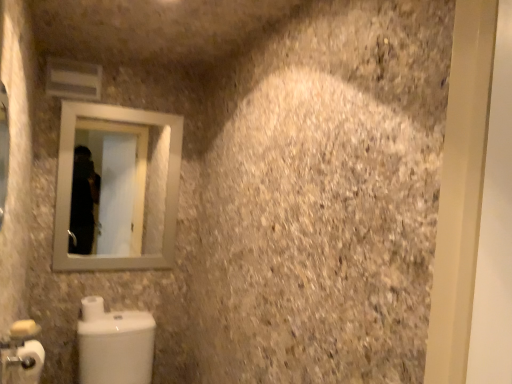
Question: Is white matte toilet paper at lower left, arranged as the second toilet paper when viewed from the front, in front of or behind white glossy toilet at lower left in the image?

Choices:
 (A) front
 (B) behind

Answer: (B)

Question: Is white matte toilet paper at lower left, acting as the 1th toilet paper starting from the back, spatially inside white glossy toilet at lower left, or outside of it?

Choices:
 (A) outside
 (B) inside

Answer: (A)

Question: Estimate the real-world distances between objects in this image. Which object is farther from the white matte toilet paper at lower left, which is the second toilet paper in back-to-front order?

Choices:
 (A) white glossy toilet at lower left
 (B) silver metallic mirror at upper left
 (C) white matte toilet paper at lower left, acting as the 1th toilet paper starting from the back

Answer: (B)

Question: Which of these objects is positioned closest to the silver metallic mirror at upper left?

Choices:
 (A) white matte toilet paper at lower left, which is the second toilet paper in back-to-front order
 (B) white glossy toilet at lower left
 (C) white matte toilet paper at lower left, acting as the 1th toilet paper starting from the back

Answer: (B)